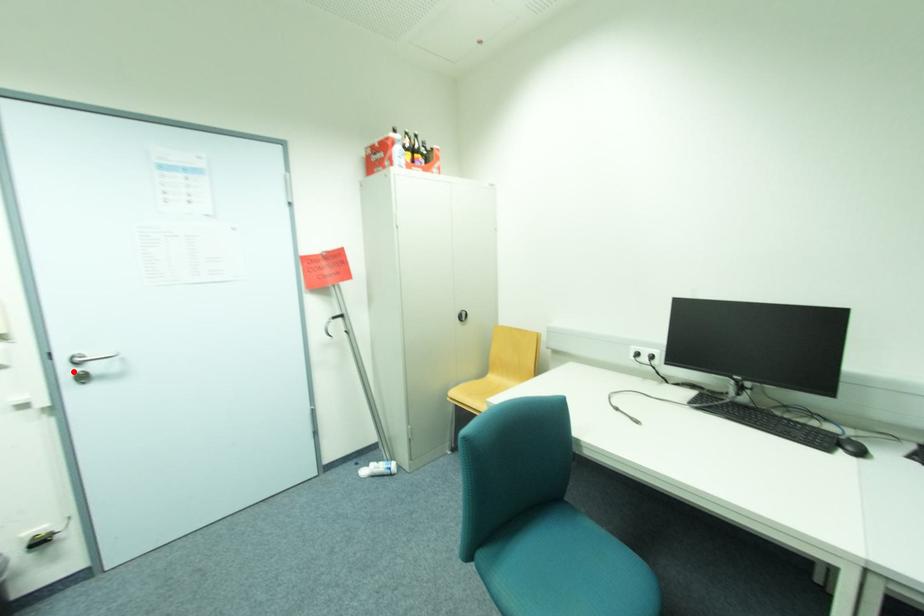
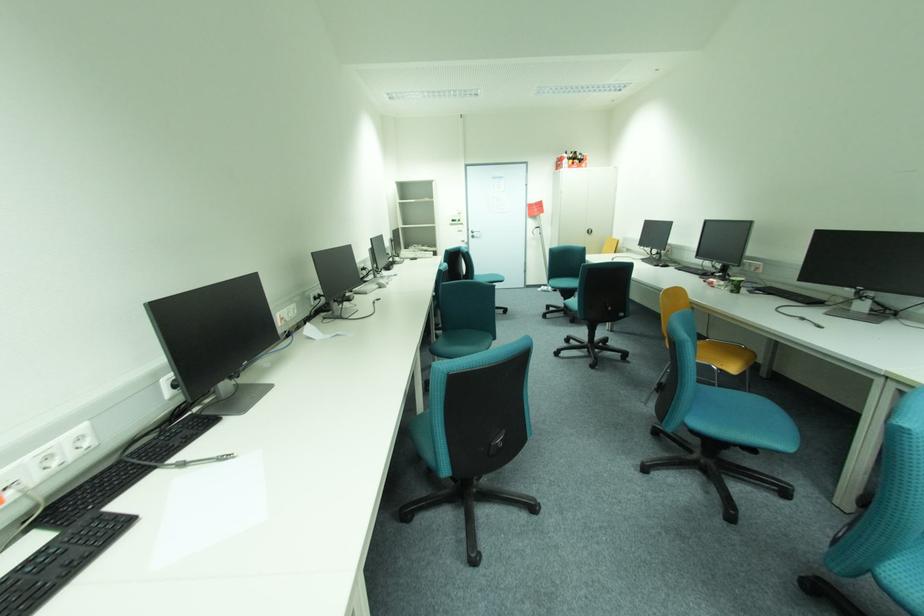
Find the pixel in the second image that matches the highlighted location in the first image.

(477, 235)